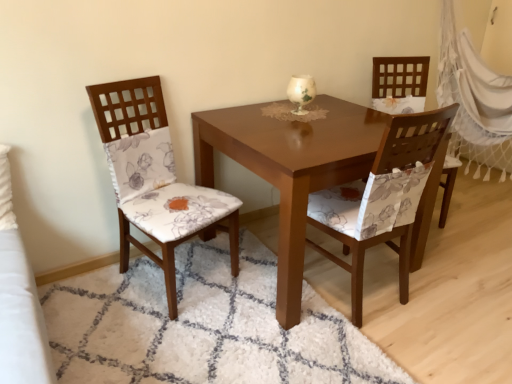
Image resolution: width=512 pixels, height=384 pixels. What are the coordinates of `free space in front of wooden chair with floral cushion at left, positioned as the first chair in left-to-right order` in the screenshot? It's located at (162, 338).